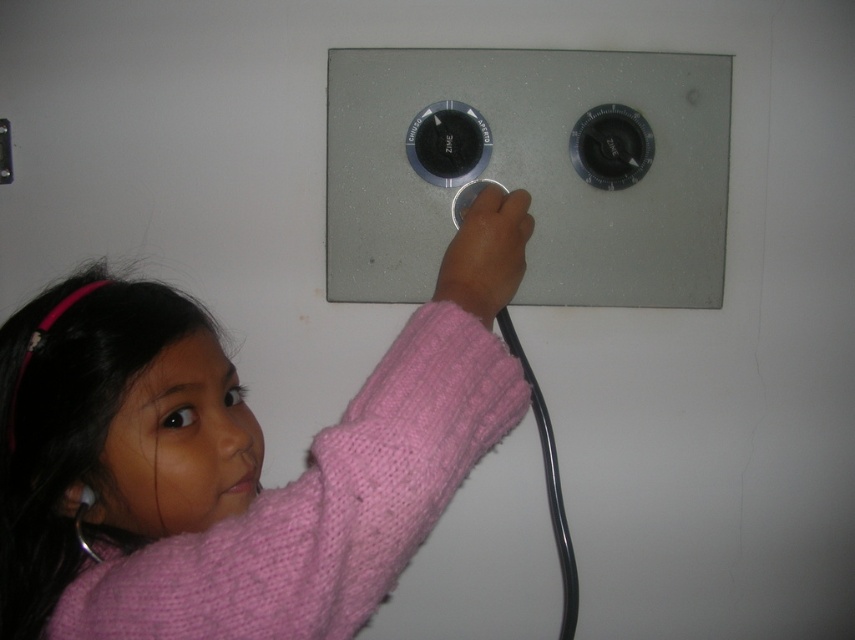
You are an interior designer assessing the wall space where the control panel is installed. The pink knitted sweater at upper center and the satin silver knobs at center are both visible in the scene. Which object takes up more visual space in the image?

The pink knitted sweater at upper center is bigger than the satin silver knobs at center, so it takes up more visual space in the image.

You are a technician inspecting a control panel. You notice the satin silver knobs at center and the matte pink sweater at center. Which object is positioned higher on the panel?

The satin silver knobs at center are positioned higher than the matte pink sweater at center, as they are located above it on the control panel.

You are standing in front of the control panel and need to press a button. There are two points marked on the panel at coordinates point (x=203, y=557) and point (x=598, y=301). Which point is closer to you?

Point (x=203, y=557) is in front of point (x=598, y=301), so the point (x=203, y=557) is closer to you.